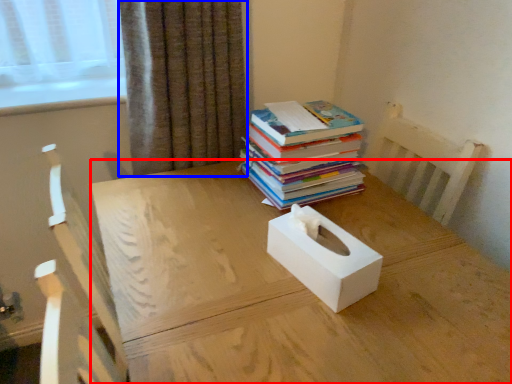
Question: Which object appears farthest to the camera in this image, desk (highlighted by a red box) or curtain (highlighted by a blue box)?

Choices:
 (A) desk
 (B) curtain

Answer: (B)